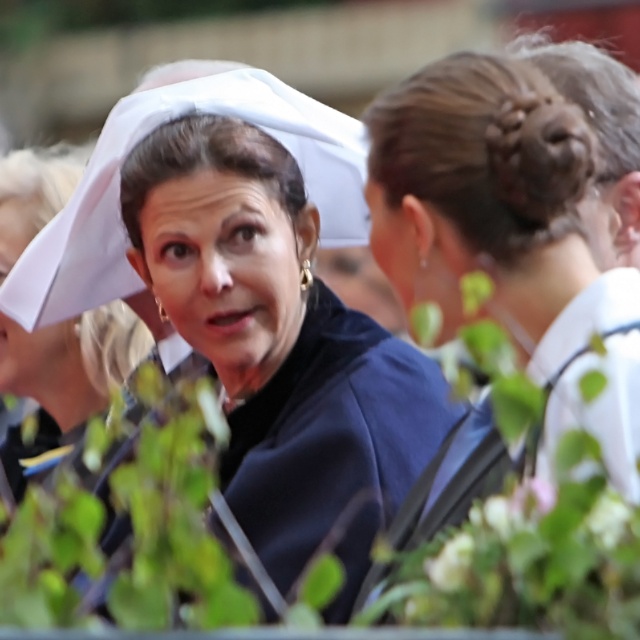
Describe the element at coordinates (280, 346) in the screenshot. I see `matte black dress at center` at that location.

Can you confirm if matte black dress at center is wider than white matte nurse hat at center?

Indeed, matte black dress at center has a greater width compared to white matte nurse hat at center.

Which is in front, point (353, 524) or point (136, 323)?

Point (353, 524) is more forward.

What are the coordinates of `matte black dress at center` in the screenshot? It's located at (280, 346).

Is matte black dress at center further to the viewer compared to sleek dark hair bun at upper right?

Yes, matte black dress at center is behind sleek dark hair bun at upper right.

Between point (227, 314) and point (420, 161), which one is positioned behind?

The point (227, 314) is behind.

I want to click on matte black dress at center, so click(280, 346).

Between sleek dark hair bun at upper right and white matte nurse hat at center, which one is positioned higher?

sleek dark hair bun at upper right is higher up.

Is sleek dark hair bun at upper right shorter than white matte nurse hat at center?

In fact, sleek dark hair bun at upper right may be taller than white matte nurse hat at center.

Where is `sleek dark hair bun at upper right`? This screenshot has height=640, width=640. sleek dark hair bun at upper right is located at coordinates pyautogui.click(x=492, y=204).

Where is `sleek dark hair bun at upper right`? This screenshot has width=640, height=640. sleek dark hair bun at upper right is located at coordinates (492, 204).